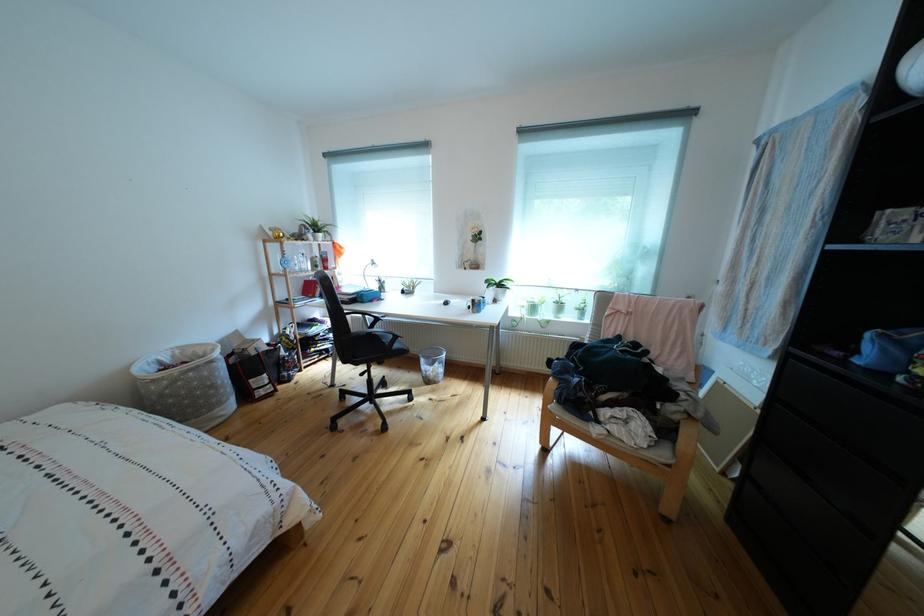
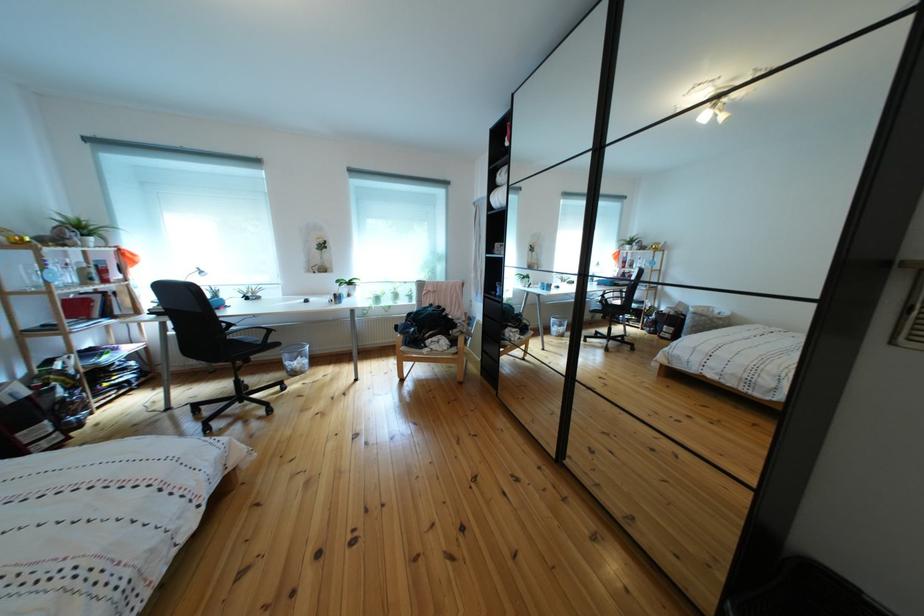
Find the pixel in the second image that matches pixel 501 289 in the first image.

(351, 288)